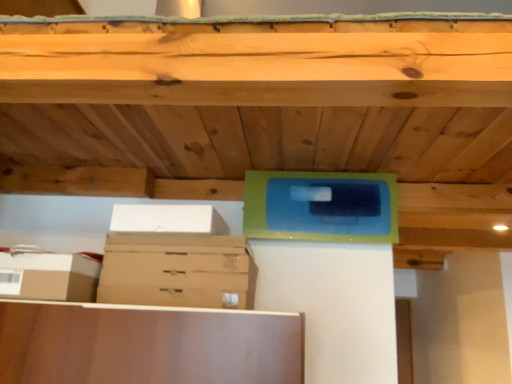
Question: Is brown cardboard drawer at center thinner than brown cardboard box at lower left, the first storage box in the bottom-to-top sequence?

Choices:
 (A) no
 (B) yes

Answer: (A)

Question: Is brown cardboard drawer at center to the right of brown cardboard box at lower left, which appears as the 2th storage box when viewed from the top, from the viewer's perspective?

Choices:
 (A) yes
 (B) no

Answer: (A)

Question: Is brown cardboard drawer at center smaller than brown cardboard box at lower left, which appears as the 2th storage box when viewed from the top?

Choices:
 (A) no
 (B) yes

Answer: (A)

Question: Considering the relative positions of brown cardboard drawer at center and brown cardboard box at lower left, which appears as the 2th storage box when viewed from the top, in the image provided, is brown cardboard drawer at center behind brown cardboard box at lower left, which appears as the 2th storage box when viewed from the top,?

Choices:
 (A) no
 (B) yes

Answer: (B)

Question: From the image's perspective, is brown cardboard drawer at center below brown cardboard box at lower left, which appears as the 2th storage box when viewed from the top?

Choices:
 (A) yes
 (B) no

Answer: (B)

Question: Is brown cardboard drawer at center outside of brown cardboard box at lower left, the first storage box in the bottom-to-top sequence?

Choices:
 (A) no
 (B) yes

Answer: (B)

Question: Can you confirm if brown cardboard drawer at center is positioned to the left of white cardboard box at upper left, the second storage box positioned from the bottom?

Choices:
 (A) yes
 (B) no

Answer: (B)

Question: Would you say brown cardboard drawer at center contains white cardboard box at upper left, arranged as the 2th storage box when viewed from the left?

Choices:
 (A) no
 (B) yes

Answer: (A)

Question: From a real-world perspective, is brown cardboard drawer at center positioned over white cardboard box at upper left, the second storage box positioned from the bottom, based on gravity?

Choices:
 (A) no
 (B) yes

Answer: (A)

Question: From the image's perspective, is brown cardboard drawer at center beneath white cardboard box at upper left, arranged as the 2th storage box when viewed from the left?

Choices:
 (A) yes
 (B) no

Answer: (A)

Question: Would you say brown cardboard drawer at center is outside white cardboard box at upper left, arranged as the 2th storage box when viewed from the left?

Choices:
 (A) no
 (B) yes

Answer: (B)

Question: Does brown cardboard drawer at center have a larger size compared to white cardboard box at upper left, the second storage box positioned from the bottom?

Choices:
 (A) no
 (B) yes

Answer: (A)

Question: Considering the relative sizes of brown cardboard box at lower left, which appears as the second storage box when viewed from the right, and brown cardboard drawer at center in the image provided, is brown cardboard box at lower left, which appears as the second storage box when viewed from the right, taller than brown cardboard drawer at center?

Choices:
 (A) yes
 (B) no

Answer: (A)